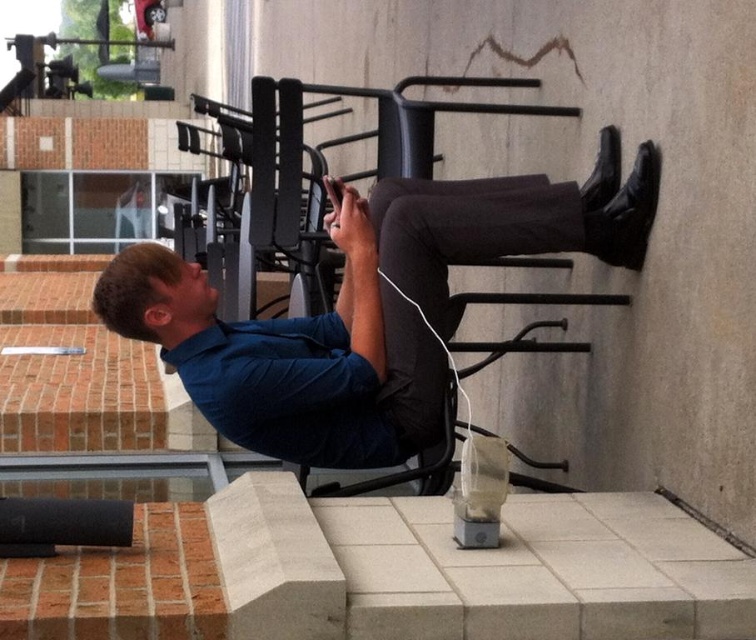
You are a photographer trying to capture a candid shot of the man using his phone. You notice the blue cotton shirt at upper center and the black matte chair at center. Which object is covering the other one in the image?

The blue cotton shirt at upper center is positioned over the black matte chair at center, so it is covering the chair in the image.

You are a photographer trying to capture a candid shot of the man on the parallel bars. You have a camera with a wide angle lens that can capture a broad area. To ensure both the blue cotton shirt at upper center and the black matte chair at center are in the frame, which object should you position closer to the camera to include both?

Since the blue cotton shirt at upper center is to the left of the black matte chair at center, you should position the camera so that both objects are within the frame. However, since the question asks which object to position closer to the camera, the answer would be neither, as their positions are fixed in the scene. To include both, adjust the camera angle or zoom out to encompass both the blue cotton shirt at upper center and the black matte chair at center.

You are a photographer standing in front of the scene. You want to take a photo that includes both the blue cotton shirt at upper center and the black matte chair at center. Which object will appear larger in the photo?

The blue cotton shirt at upper center appears larger in the photo because it is closer to the viewer than the black matte chair at center.